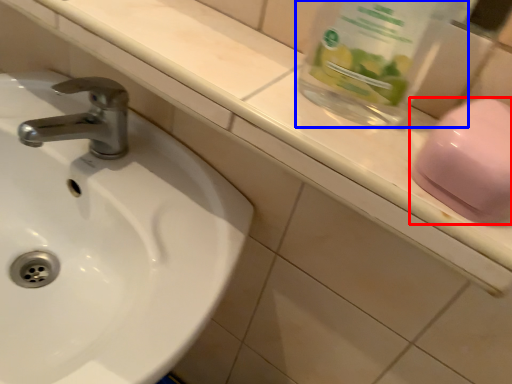
Question: Which point is further to the camera, soap (highlighted by a red box) or glass jar (highlighted by a blue box)?

Choices:
 (A) soap
 (B) glass jar

Answer: (A)